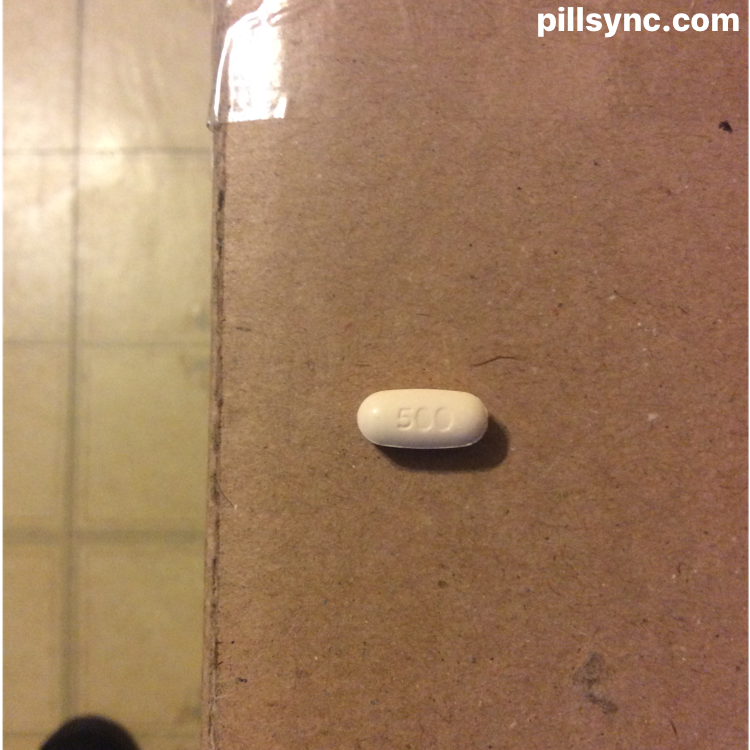
This screenshot has height=750, width=750. Find the location of `wall`. wall is located at coordinates (633, 72).